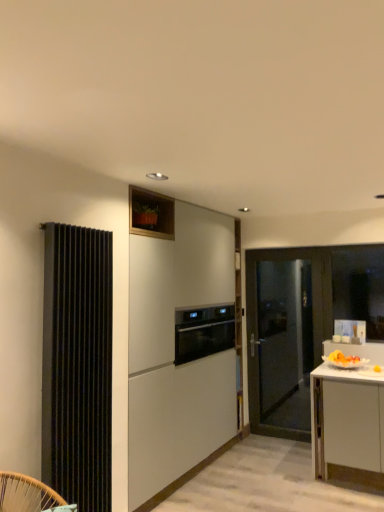
Question: Is white matte cabinet at center to the right of black ribbed radiator at left from the viewer's perspective?

Choices:
 (A) yes
 (B) no

Answer: (A)

Question: Can black ribbed radiator at left be found inside white matte cabinet at center?

Choices:
 (A) yes
 (B) no

Answer: (B)

Question: Is white matte cabinet at center taller than black ribbed radiator at left?

Choices:
 (A) yes
 (B) no

Answer: (A)

Question: Is white matte cabinet at center closer to camera compared to black ribbed radiator at left?

Choices:
 (A) yes
 (B) no

Answer: (B)

Question: Could you tell me if white matte cabinet at center is turned towards black ribbed radiator at left?

Choices:
 (A) no
 (B) yes

Answer: (A)

Question: Can you confirm if white matte cabinet at center is thinner than black ribbed radiator at left?

Choices:
 (A) yes
 (B) no

Answer: (B)

Question: Is black ribbed radiator at left behind matte black door at right?

Choices:
 (A) no
 (B) yes

Answer: (A)

Question: Is matte black door at right located within black ribbed radiator at left?

Choices:
 (A) yes
 (B) no

Answer: (B)

Question: Does black ribbed radiator at left have a lesser height compared to matte black door at right?

Choices:
 (A) yes
 (B) no

Answer: (A)

Question: Is black ribbed radiator at left to the left of matte black door at right from the viewer's perspective?

Choices:
 (A) yes
 (B) no

Answer: (A)

Question: Does black ribbed radiator at left appear on the right side of matte black door at right?

Choices:
 (A) no
 (B) yes

Answer: (A)

Question: Considering the relative sizes of black ribbed radiator at left and matte black door at right in the image provided, is black ribbed radiator at left taller than matte black door at right?

Choices:
 (A) yes
 (B) no

Answer: (B)

Question: Can you confirm if matte black door at right is wider than satin black oven at center?

Choices:
 (A) yes
 (B) no

Answer: (B)